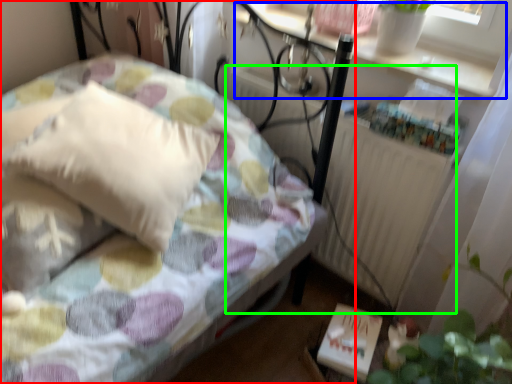
Question: Based on their relative distances, which object is nearer to bed (highlighted by a red box)? Choose from window sill (highlighted by a blue box) and radiator (highlighted by a green box).

Choices:
 (A) window sill
 (B) radiator

Answer: (B)